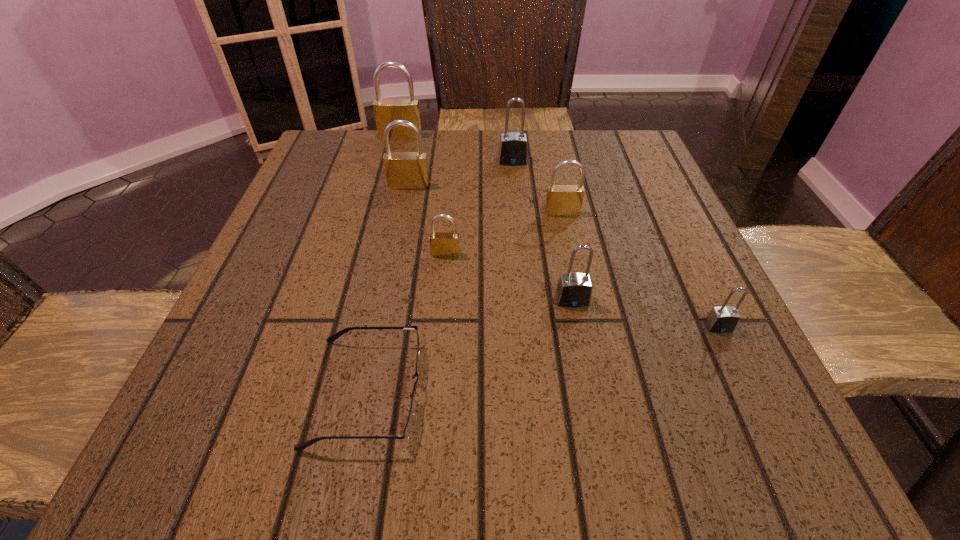
Find the location of a particular element. This screenshot has height=540, width=960. the nearest padlock is located at coordinates (723, 319).

Find the location of a particular element. the rightmost object is located at coordinates [723, 319].

Locate an element on the screen. The height and width of the screenshot is (540, 960). the smallest brass padlock is located at coordinates (441, 244).

Image resolution: width=960 pixels, height=540 pixels. I want to click on the third brass padlock from left to right, so click(x=441, y=244).

This screenshot has width=960, height=540. Find the location of `the shortest object`. the shortest object is located at coordinates (408, 428).

You are a GUI agent. You are given a task and a screenshot of the screen. Output one action in this format:
    pyautogui.click(x=<x>, y=<y>)
    Task: Click on the nearest object
    The width and height of the screenshot is (960, 540).
    Given the screenshot: What is the action you would take?
    pyautogui.click(x=408, y=428)

Where is `free space located 0.280m on the front-facing side of the tallest padlock`? free space located 0.280m on the front-facing side of the tallest padlock is located at coordinates (382, 210).

You are a GUI agent. You are given a task and a screenshot of the screen. Output one action in this format:
    pyautogui.click(x=<x>, y=<y>)
    Task: Click on the free region located on the shackle of the farthest gray padlock
    The image size is (960, 540).
    Given the screenshot: What is the action you would take?
    pyautogui.click(x=515, y=181)

In order to click on vacant space located on the front-facing side of the second biggest brass padlock in this screenshot , I will do `click(381, 328)`.

Where is `free location located 0.150m on the shackle of the second nearest padlock`? The height and width of the screenshot is (540, 960). free location located 0.150m on the shackle of the second nearest padlock is located at coordinates (589, 392).